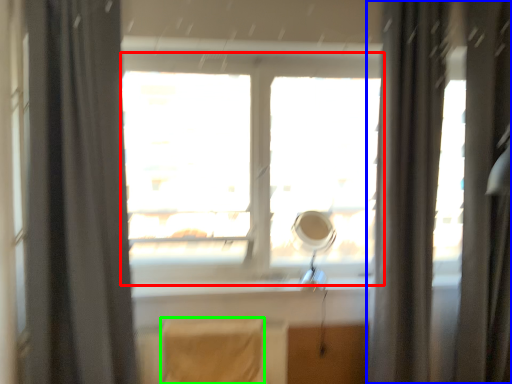
Question: Which is nearer to the window (highlighted by a red box)? curtain (highlighted by a blue box) or chair (highlighted by a green box).

Choices:
 (A) curtain
 (B) chair

Answer: (A)